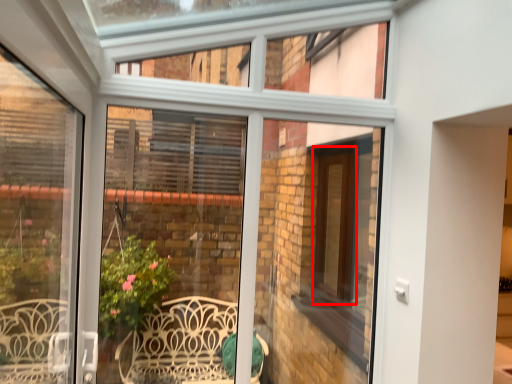
Question: From the image's perspective, considering the relative positions of screen door (annotated by the red box) and window frame in the image provided, where is screen door (annotated by the red box) located with respect to the staircase?

Choices:
 (A) below
 (B) above

Answer: (A)